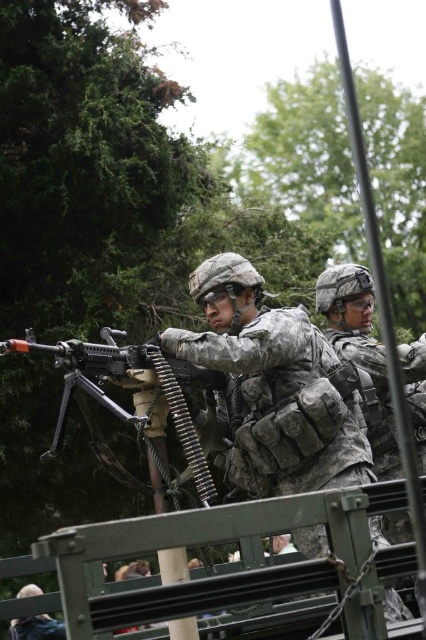
Question: Is camouflage fabric uniform at center in front of matte black rifle at center?

Choices:
 (A) no
 (B) yes

Answer: (A)

Question: Which point is closer to the camera taking this photo?

Choices:
 (A) (420, 436)
 (B) (55, 634)
 (C) (322, 433)

Answer: (C)

Question: Observing the image, what is the correct spatial positioning of camouflage fabric uniform at center in reference to matte black rifle at center?

Choices:
 (A) right
 (B) left

Answer: (A)

Question: From the image, what is the correct spatial relationship of camouflage fabric helmet at center in relation to matte black rifle at center?

Choices:
 (A) left
 (B) right

Answer: (B)

Question: Which point appears closest to the camera in this image?

Choices:
 (A) (402, 476)
 (B) (169, 369)
 (C) (49, 621)
 (D) (373, 500)

Answer: (D)

Question: Which point is farther from the camera taking this photo?

Choices:
 (A) (101, 330)
 (B) (37, 636)

Answer: (B)